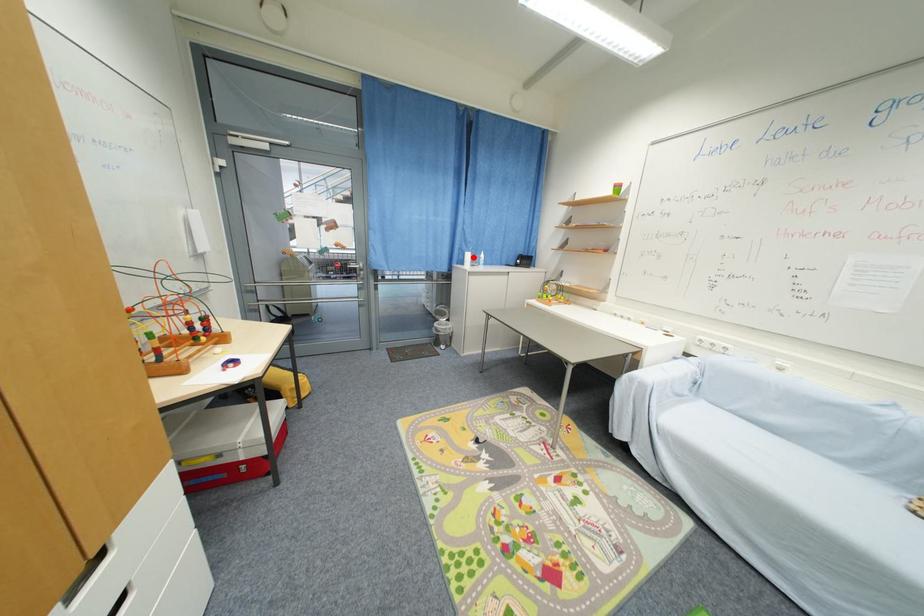
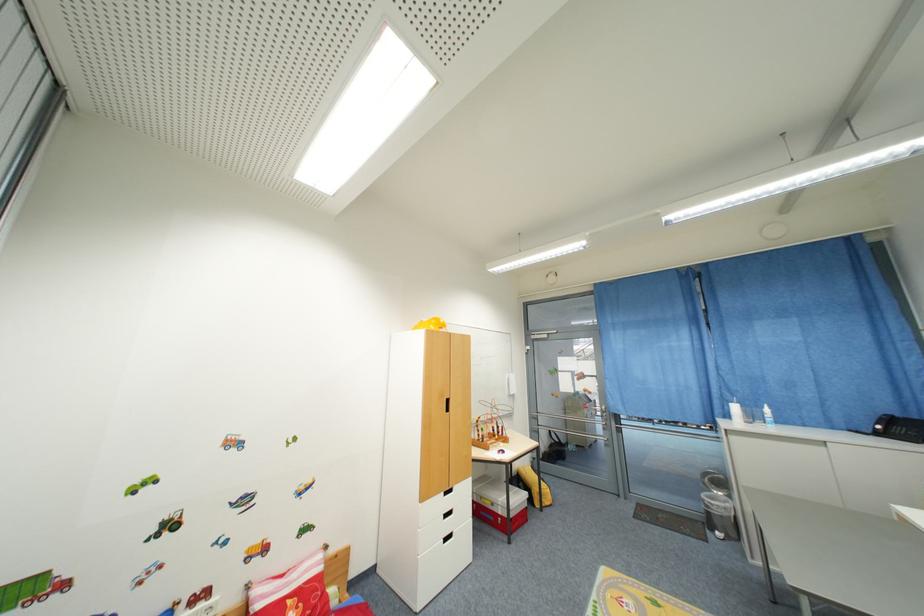
Find the pixel in the second image that matches the highlighted location in the first image.

(740, 410)